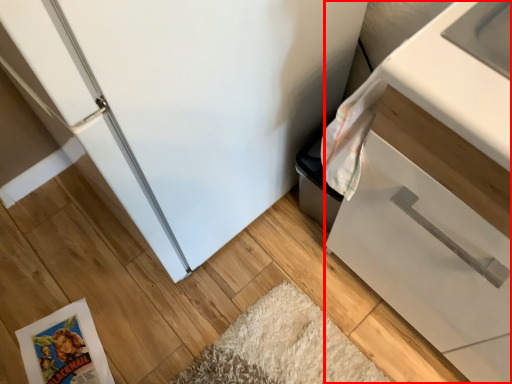
Question: Observing the image, what is the correct spatial positioning of cabinetry (annotated by the red box) in reference to comic book?

Choices:
 (A) right
 (B) left

Answer: (A)